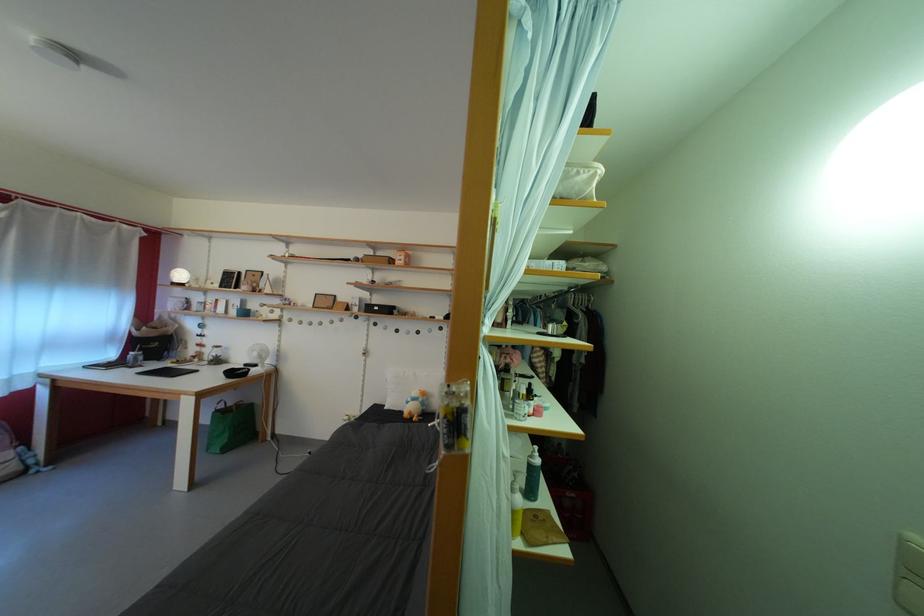
At what (x,y) coordinates should I click in order to perform the action: click on spherical table lamp. Please return your answer as a coordinate pair (x, y). This screenshot has width=924, height=616. Looking at the image, I should click on (257, 354).